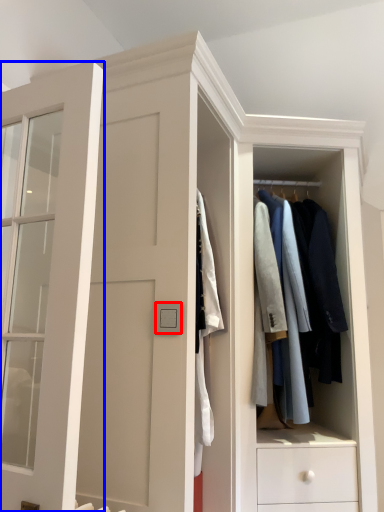
Question: Among these objects, which one is farthest to the camera, light switch (highlighted by a red box) or door (highlighted by a blue box)?

Choices:
 (A) light switch
 (B) door

Answer: (A)